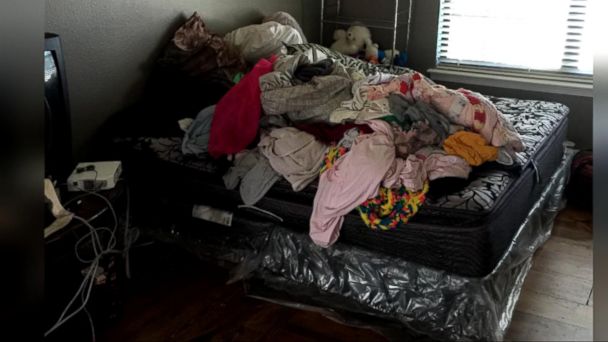
At what (x,y) coordinates should I click in order to perform the action: click on black mattress. Please return your answer as a coordinate pair (x, y). The width and height of the screenshot is (608, 342). Looking at the image, I should click on (496, 222).